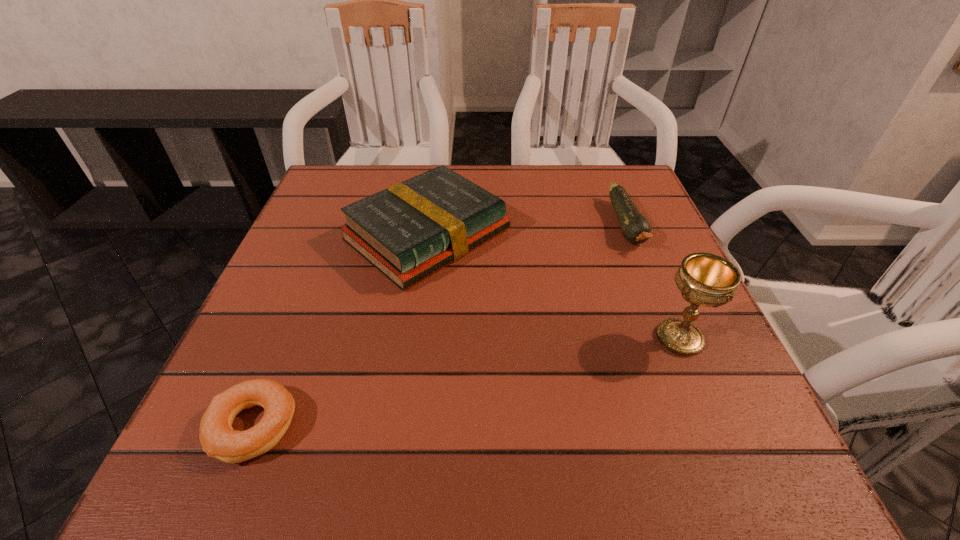
Where is `chalice`? The image size is (960, 540). chalice is located at coordinates (704, 279).

Locate an element on the screen. the tallest object is located at coordinates (704, 279).

Locate an element on the screen. The width and height of the screenshot is (960, 540). the third shortest object is located at coordinates (410, 230).

I want to click on the third tallest object, so click(635, 228).

Locate an element on the screen. The height and width of the screenshot is (540, 960). bagel is located at coordinates (219, 440).

Where is `the nearest object`? the nearest object is located at coordinates (219, 440).

Image resolution: width=960 pixels, height=540 pixels. Find the location of `vacant space located 0.190m on the front of the third farthest object`. vacant space located 0.190m on the front of the third farthest object is located at coordinates (737, 475).

Find the location of a particular element. This screenshot has width=960, height=540. vacant space situated 0.180m on the right of the third shortest object is located at coordinates (591, 235).

Find the location of a particular element. free space located 0.140m at the blossom end of the zucchini is located at coordinates (659, 304).

Where is `free space located 0.200m on the back of the nearest object`? The height and width of the screenshot is (540, 960). free space located 0.200m on the back of the nearest object is located at coordinates (305, 298).